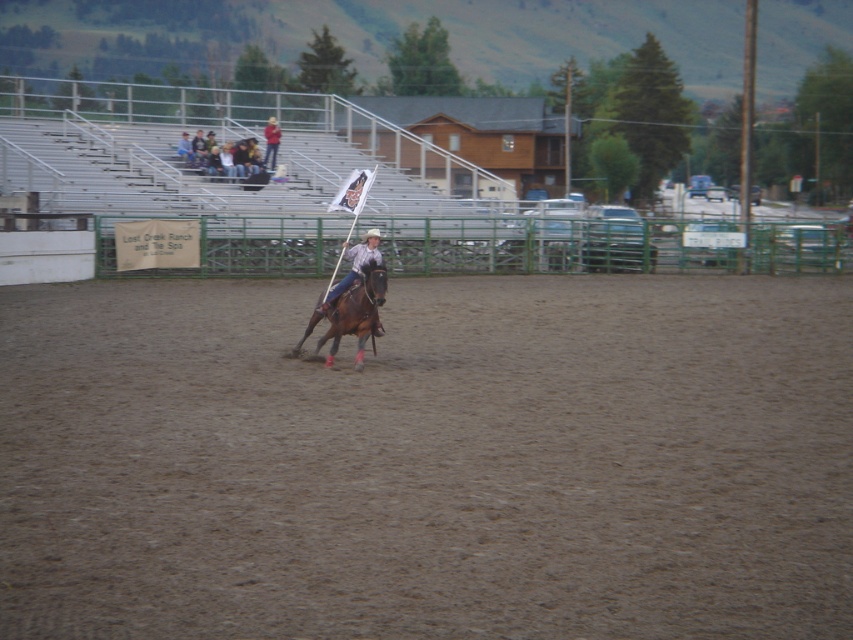
Question: Which object is the farthest from the denim jacket at upper left?

Choices:
 (A) brown sandy dirt at center
 (B) matte brown horse at center
 (C) light brown leather jacket at upper center

Answer: (B)

Question: Which of these objects is positioned farthest from the light brown leather jacket at upper center?

Choices:
 (A) matte brown horse at center
 (B) denim jacket at upper left

Answer: (A)

Question: Does matte brown horse at center have a lesser width compared to light brown leather jacket at upper center?

Choices:
 (A) yes
 (B) no

Answer: (A)

Question: Is brown sandy dirt at center above matte brown horse at center?

Choices:
 (A) yes
 (B) no

Answer: (B)

Question: Does brown glossy horse at center have a smaller size compared to matte brown horse at center?

Choices:
 (A) no
 (B) yes

Answer: (A)

Question: Which of the following is the farthest from the observer?

Choices:
 (A) (703, 588)
 (B) (357, 307)
 (C) (274, 141)

Answer: (C)